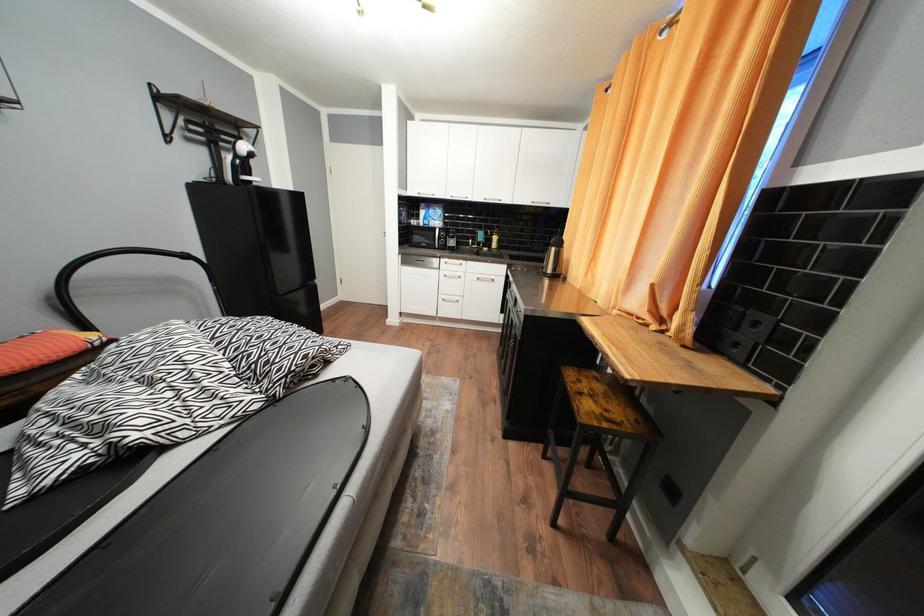
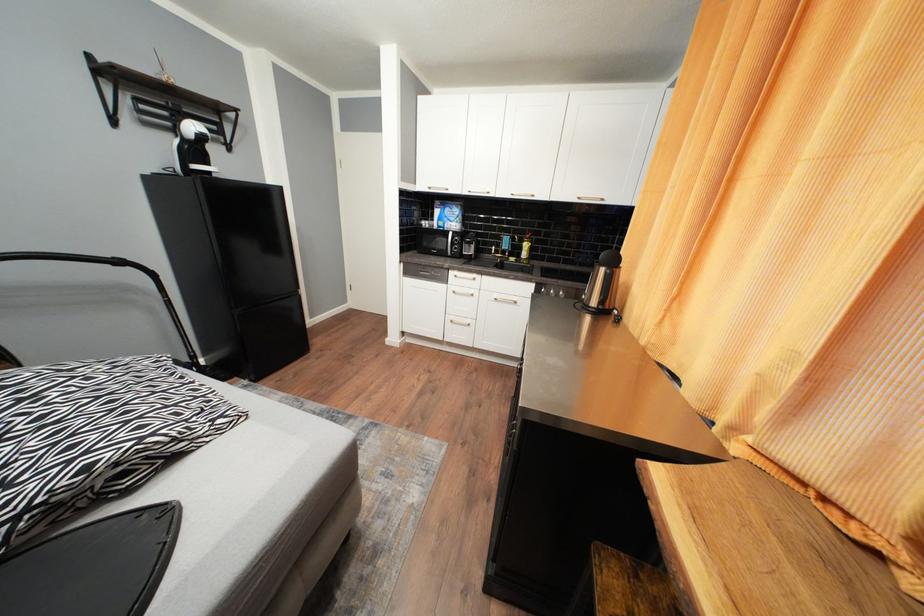
Question: The camera is either moving clockwise (left) or counter-clockwise (right) around the object. The first image is from the beginning of the video and the second image is from the end. Is the camera moving left or right when shooting the video?

Choices:
 (A) Left
 (B) Right

Answer: (B)